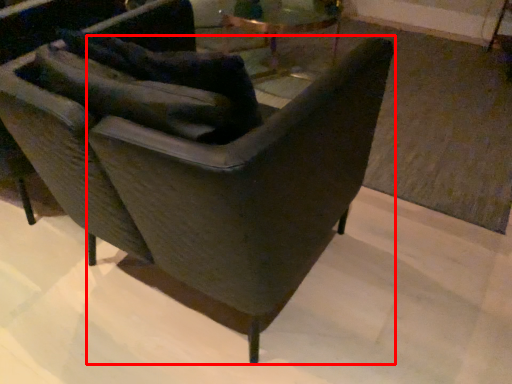
Question: From the image's perspective, what is the correct spatial positioning of rocking chair (annotated by the red box) in reference to chair?

Choices:
 (A) above
 (B) below

Answer: (B)